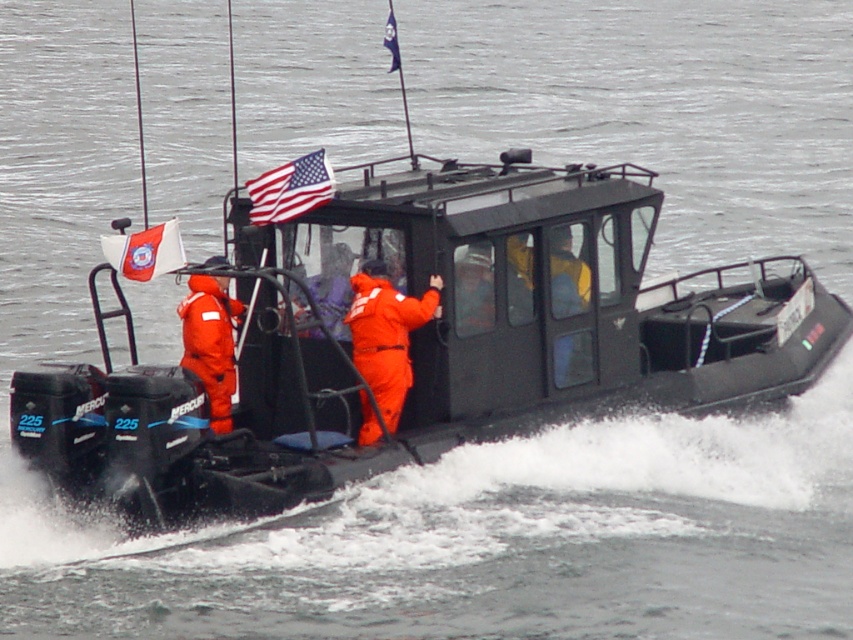
Does point (302, 189) lie behind point (390, 49)?

No, it is not.

Does point (294, 173) lie in front of point (398, 54)?

Yes, it is.

Between point (274, 196) and point (392, 36), which one is positioned behind?

Positioned behind is point (392, 36).

Locate an element on the screen. The height and width of the screenshot is (640, 853). american flag at upper center is located at coordinates (289, 188).

Is orange smooth suit at center positioned at the back of blue fabric flag at upper center?

No, it is not.

Identify the location of orange smooth suit at center. Image resolution: width=853 pixels, height=640 pixels. (210, 342).

Is orange smooth suit at center below white fabric flag at upper left?

Indeed, orange smooth suit at center is positioned under white fabric flag at upper left.

Is orange smooth suit at center shorter than white fabric flag at upper left?

In fact, orange smooth suit at center may be taller than white fabric flag at upper left.

Does point (204, 352) lie in front of point (125, 250)?

No.

I want to click on orange smooth suit at center, so click(210, 342).